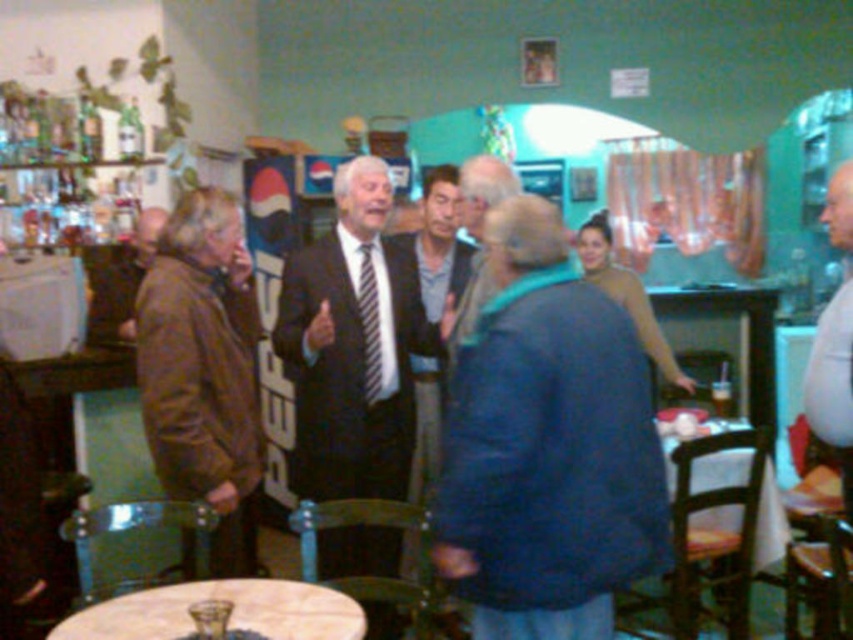
Question: Based on their relative distances, which object is nearer to the brown leather jacket at left?

Choices:
 (A) white cotton shirt at right
 (B) blue woolen sweater at center
 (C) striped fabric tie at center

Answer: (C)

Question: Is blue woolen sweater at center closer to camera compared to white cotton shirt at right?

Choices:
 (A) yes
 (B) no

Answer: (A)

Question: Is white cotton shirt at right to the left of striped fabric tie at center from the viewer's perspective?

Choices:
 (A) yes
 (B) no

Answer: (B)

Question: Is dark suit at center below brown leather jacket at left?

Choices:
 (A) yes
 (B) no

Answer: (A)

Question: Which point is farther to the camera?

Choices:
 (A) (573, 636)
 (B) (366, 394)
 (C) (364, 397)
 (D) (846, 452)

Answer: (B)

Question: Which object appears farthest from the camera in this image?

Choices:
 (A) white cotton shirt at right
 (B) blue woolen sweater at center

Answer: (A)